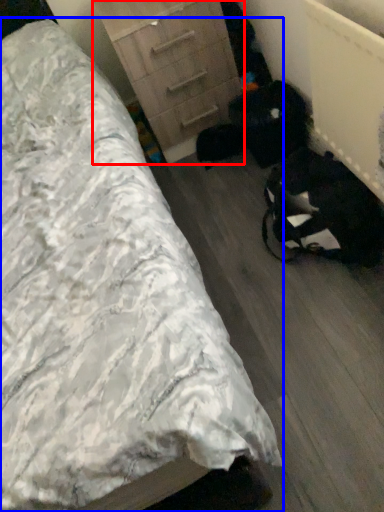
Question: Among these objects, which one is nearest to the camera, chest of drawers (highlighted by a red box) or bed (highlighted by a blue box)?

Choices:
 (A) chest of drawers
 (B) bed

Answer: (B)